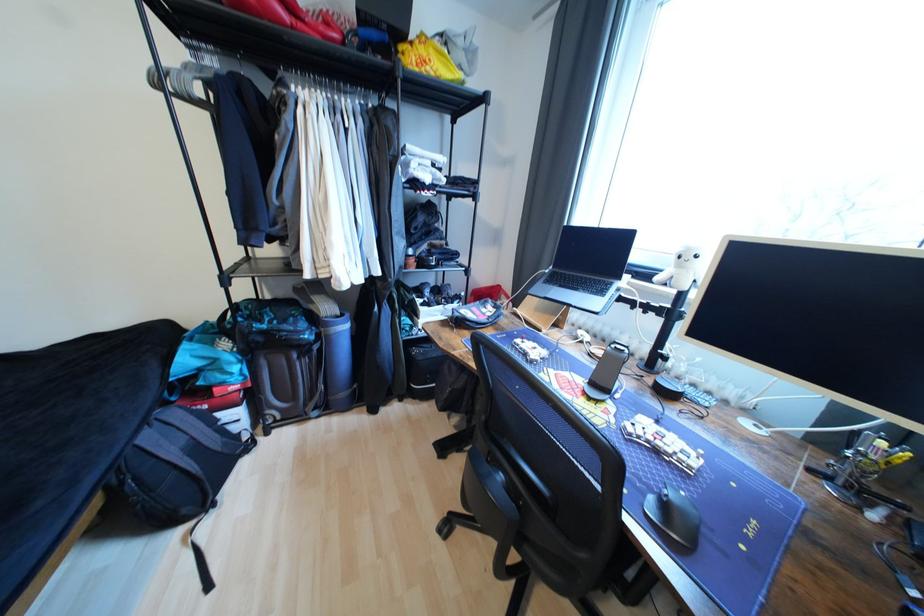
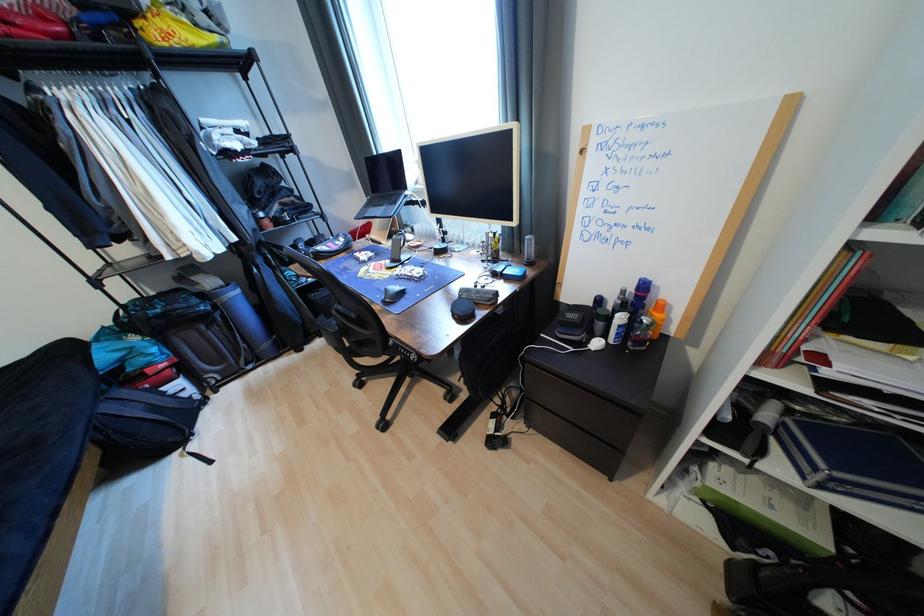
Find the pixel in the second image that matches [582,291] in the first image.

(388, 207)